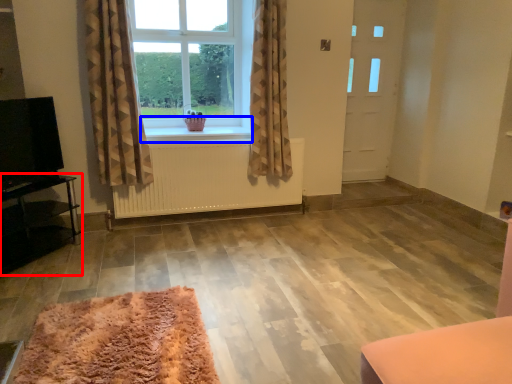
Question: Among these objects, which one is farthest to the camera, furniture (highlighted by a red box) or window sill (highlighted by a blue box)?

Choices:
 (A) furniture
 (B) window sill

Answer: (B)